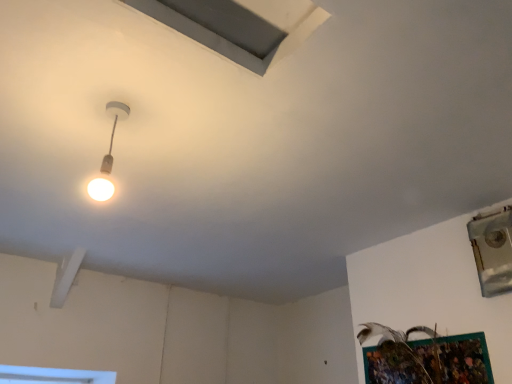
Question: Is gray matte exhaust hood at upper center positioned before metallic silver window at upper right?

Choices:
 (A) no
 (B) yes

Answer: (B)

Question: Is gray matte exhaust hood at upper center at the right side of metallic silver window at upper right?

Choices:
 (A) yes
 (B) no

Answer: (B)

Question: Is gray matte exhaust hood at upper center facing towards metallic silver window at upper right?

Choices:
 (A) yes
 (B) no

Answer: (B)

Question: From a real-world perspective, is gray matte exhaust hood at upper center physically below metallic silver window at upper right?

Choices:
 (A) no
 (B) yes

Answer: (A)

Question: Is gray matte exhaust hood at upper center located outside metallic silver window at upper right?

Choices:
 (A) yes
 (B) no

Answer: (A)

Question: From a real-world perspective, is matte white lamp at upper left above or below gray matte exhaust hood at upper center?

Choices:
 (A) above
 (B) below

Answer: (B)

Question: From the image's perspective, is matte white lamp at upper left located above or below gray matte exhaust hood at upper center?

Choices:
 (A) above
 (B) below

Answer: (B)

Question: Relative to gray matte exhaust hood at upper center, is matte white lamp at upper left in front or behind?

Choices:
 (A) behind
 (B) front

Answer: (A)

Question: In the image, is matte white lamp at upper left on the left side or the right side of gray matte exhaust hood at upper center?

Choices:
 (A) left
 (B) right

Answer: (A)

Question: In terms of width, does matte white lamp at upper left look wider or thinner when compared to metallic silver window at upper right?

Choices:
 (A) wide
 (B) thin

Answer: (B)

Question: In terms of size, does matte white lamp at upper left appear bigger or smaller than metallic silver window at upper right?

Choices:
 (A) small
 (B) big

Answer: (A)

Question: Would you say matte white lamp at upper left is to the left or to the right of metallic silver window at upper right in the picture?

Choices:
 (A) left
 (B) right

Answer: (A)

Question: Is matte white lamp at upper left inside or outside of metallic silver window at upper right?

Choices:
 (A) outside
 (B) inside

Answer: (A)

Question: Based on their sizes in the image, would you say metallic silver window at upper right is bigger or smaller than matte white lamp at upper left?

Choices:
 (A) big
 (B) small

Answer: (A)

Question: Considering the relative positions of metallic silver window at upper right and matte white lamp at upper left in the image provided, is metallic silver window at upper right to the left or to the right of matte white lamp at upper left?

Choices:
 (A) left
 (B) right

Answer: (B)